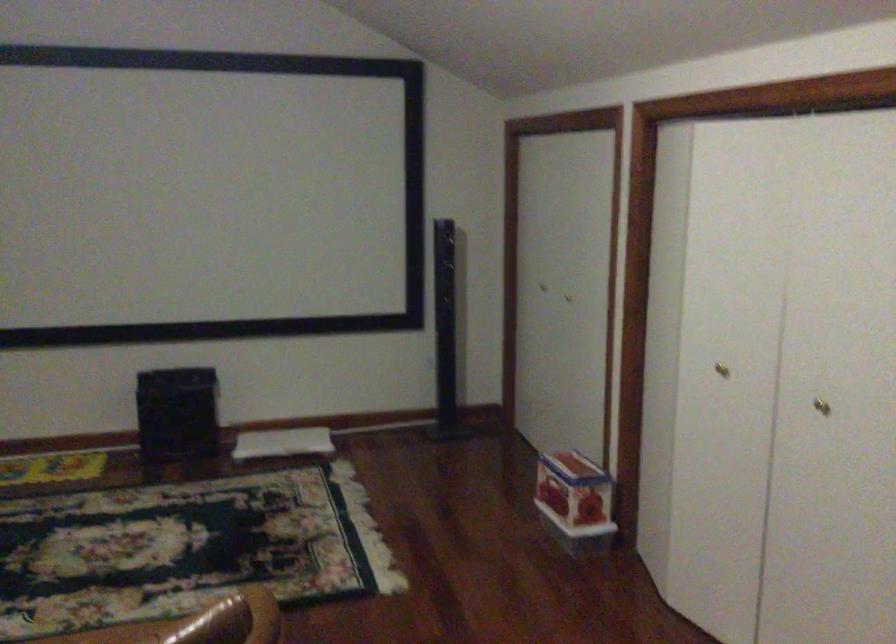
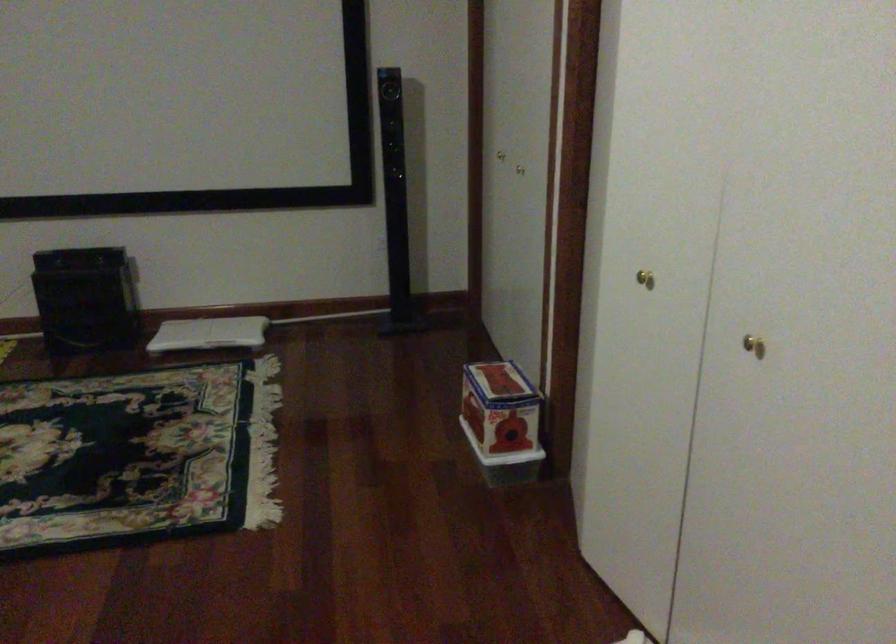
In the second image, find the point that corresponds to pixel 583 496 in the first image.

(501, 422)